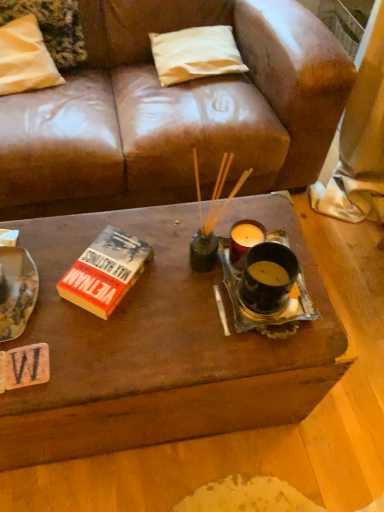
Question: Is white fabric pillow at upper left, positioned as the 2th pillow in right-to-left order, positioned in front of white fabric pillow at upper center, which is the first pillow in right-to-left order?

Choices:
 (A) no
 (B) yes

Answer: (B)

Question: From a real-world perspective, is white fabric pillow at upper left, positioned as the 2th pillow in right-to-left order, on top of white fabric pillow at upper center, the second pillow when ordered from left to right?

Choices:
 (A) no
 (B) yes

Answer: (B)

Question: Can you confirm if white fabric pillow at upper left, positioned as the 2th pillow in right-to-left order, is thinner than white fabric pillow at upper center, the second pillow when ordered from left to right?

Choices:
 (A) no
 (B) yes

Answer: (A)

Question: Can you confirm if white fabric pillow at upper left, positioned as the 2th pillow in right-to-left order, is smaller than white fabric pillow at upper center, the second pillow when ordered from left to right?

Choices:
 (A) no
 (B) yes

Answer: (A)

Question: Considering the relative sizes of white fabric pillow at upper left, the first pillow from the left, and white fabric pillow at upper center, which is the first pillow in right-to-left order, in the image provided, is white fabric pillow at upper left, the first pillow from the left, taller than white fabric pillow at upper center, which is the first pillow in right-to-left order,?

Choices:
 (A) yes
 (B) no

Answer: (A)

Question: Is white fabric pillow at upper center, the second pillow when ordered from left to right, inside or outside of hardcover book at center-left?

Choices:
 (A) outside
 (B) inside

Answer: (A)

Question: Looking at the image, does white fabric pillow at upper center, the second pillow when ordered from left to right, seem bigger or smaller compared to hardcover book at center-left?

Choices:
 (A) big
 (B) small

Answer: (A)

Question: Considering the relative positions of white fabric pillow at upper center, which is the first pillow in right-to-left order, and hardcover book at center-left in the image provided, is white fabric pillow at upper center, which is the first pillow in right-to-left order, to the left or to the right of hardcover book at center-left?

Choices:
 (A) right
 (B) left

Answer: (A)

Question: From the image's perspective, relative to hardcover book at center-left, is white fabric pillow at upper center, the second pillow when ordered from left to right, above or below?

Choices:
 (A) below
 (B) above

Answer: (B)

Question: Would you say hardcover book at center-left is inside or outside white fabric pillow at upper center, the second pillow when ordered from left to right?

Choices:
 (A) inside
 (B) outside

Answer: (B)

Question: Is point (137, 241) closer or farther from the camera than point (188, 60)?

Choices:
 (A) closer
 (B) farther

Answer: (A)

Question: From a real-world perspective, relative to white fabric pillow at upper center, the second pillow when ordered from left to right, is hardcover book at center-left vertically above or below?

Choices:
 (A) above
 (B) below

Answer: (A)

Question: Is hardcover book at center-left taller or shorter than white fabric pillow at upper center, which is the first pillow in right-to-left order?

Choices:
 (A) short
 (B) tall

Answer: (A)

Question: From the image's perspective, relative to hardcover book at center-left, is white fabric pillow at upper left, positioned as the 2th pillow in right-to-left order, above or below?

Choices:
 (A) above
 (B) below

Answer: (A)

Question: Considering their positions, is white fabric pillow at upper left, positioned as the 2th pillow in right-to-left order, located in front of or behind hardcover book at center-left?

Choices:
 (A) front
 (B) behind

Answer: (B)